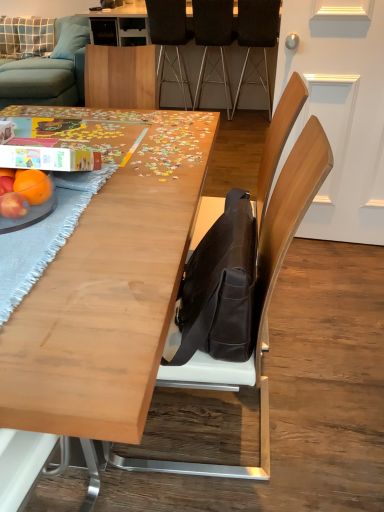
Question: From the image's perspective, is matte orange at table left located above or below brown leather chair at center, which is the 4th chair from back to front?

Choices:
 (A) above
 (B) below

Answer: (A)

Question: From their relative heights in the image, would you say matte orange at table left is taller or shorter than brown leather chair at center, which is the 1th chair from front to back?

Choices:
 (A) short
 (B) tall

Answer: (A)

Question: Considering the real-world distances, which object is closest to the matte black messenger bag at center?

Choices:
 (A) red matte apple at lower left, the first apple viewed from the top
 (B) light blue fabric couch at upper left
 (C) light wood table at center, the first table when ordered from bottom to top
 (D) red matte apple at lower left, positioned as the second apple in back-to-front order
 (E) blue woven placemat at left

Answer: (C)

Question: Which of these objects is positioned farthest from the light blue fabric pillow at upper left, which appears as the second pillow when viewed from the right?

Choices:
 (A) red matte apple at lower left, the first apple viewed from the top
 (B) black leather chair at upper center, which is the 4th chair from front to back
 (C) dark brown leather chair at upper right, placed as the 3th chair when sorted from back to front
 (D) matte black messenger bag at center
 (E) black fabric chair at center, the third chair when ordered from front to back

Answer: (D)